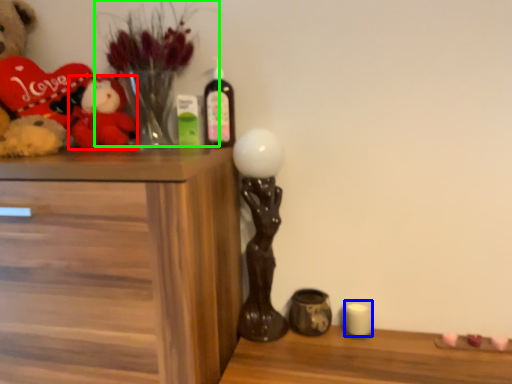
Question: Estimate the real-world distances between objects in this image. Which object is farther from toy (highlighted by a red box), candle (highlighted by a blue box) or floral arrangement (highlighted by a green box)?

Choices:
 (A) candle
 (B) floral arrangement

Answer: (A)